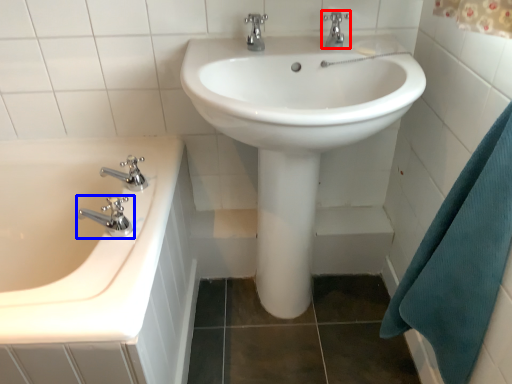
Question: Which object is closer to the camera taking this photo, tap (highlighted by a red box) or tap (highlighted by a blue box)?

Choices:
 (A) tap
 (B) tap

Answer: (B)